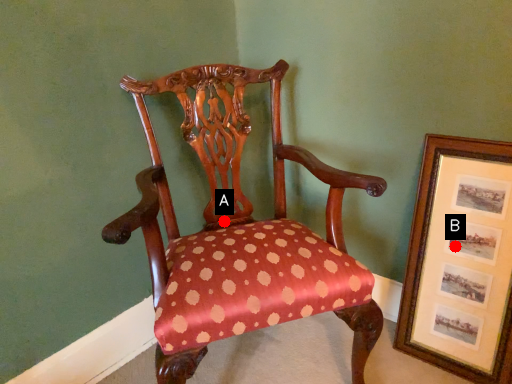
Question: Two points are circled on the image, labeled by A and B beside each circle. Which point is closer to the camera?

Choices:
 (A) A is closer
 (B) B is closer

Answer: (B)